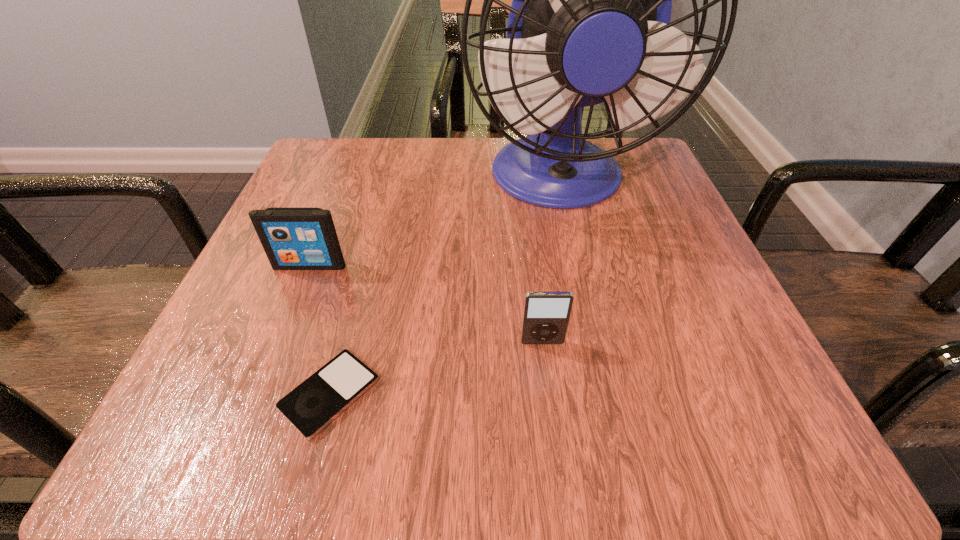
This screenshot has width=960, height=540. In order to click on vacant region located 0.390m on the back of the nearest iPod in this screenshot , I will do `click(385, 189)`.

Where is `object that is positioned at the far edge`? Image resolution: width=960 pixels, height=540 pixels. object that is positioned at the far edge is located at coordinates coord(589,23).

Image resolution: width=960 pixels, height=540 pixels. I want to click on object situated at the near edge, so click(x=316, y=402).

The image size is (960, 540). I want to click on object that is at the right edge, so click(589, 23).

You are a GUI agent. You are given a task and a screenshot of the screen. Output one action in this format:
    pyautogui.click(x=<x>, y=<y>)
    Task: Click on the object that is at the near left corner
    
    Given the screenshot: What is the action you would take?
    pyautogui.click(x=316, y=402)

Locate an element on the screen. Image resolution: width=960 pixels, height=540 pixels. object present at the far right corner is located at coordinates (589, 23).

What are the coordinates of `free space at the far edge of the desktop` in the screenshot? It's located at pos(395,172).

Where is `vacant region at the near edge`? vacant region at the near edge is located at coordinates (537, 400).

The image size is (960, 540). In order to click on vacant space at the right edge in this screenshot , I will do `click(661, 278)`.

The image size is (960, 540). I want to click on vacant region at the far left corner of the desktop, so click(x=367, y=148).